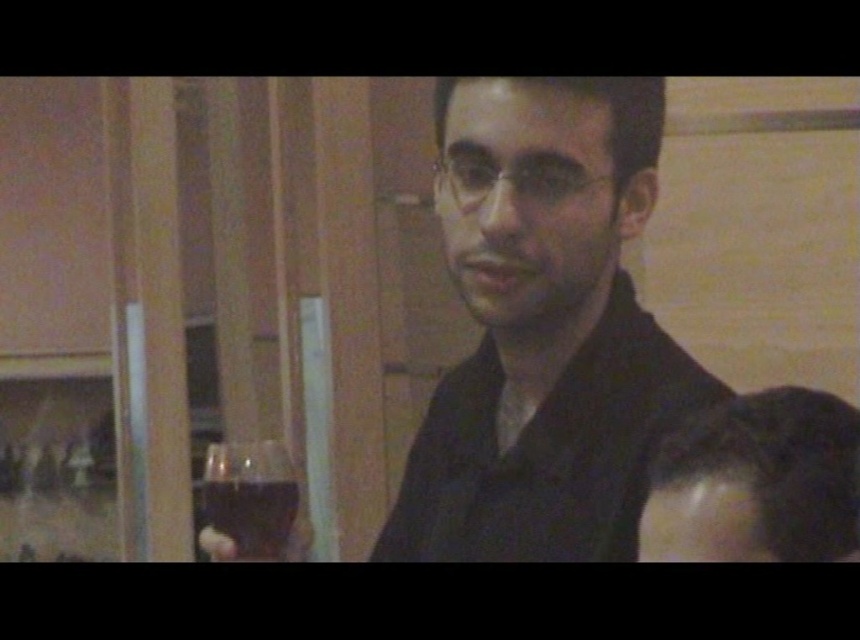
Can you confirm if matte black shirt at center is bigger than dark brown hair at lower right?

Yes.

The height and width of the screenshot is (640, 860). I want to click on matte black shirt at center, so click(544, 328).

Looking at this image, is dark brown hair at lower right in front of transparent glass at left?

Yes, it is in front of transparent glass at left.

Who is higher up, dark brown hair at lower right or transparent glass at left?

dark brown hair at lower right is above.

Which is behind, point (680, 486) or point (213, 509)?

Positioned behind is point (213, 509).

This screenshot has height=640, width=860. In order to click on dark brown hair at lower right in this screenshot , I will do click(x=757, y=483).

Is matte black shirt at center to the right of transparent glass at left from the viewer's perspective?

Yes, matte black shirt at center is to the right of transparent glass at left.

Is point (482, 106) less distant than point (269, 556)?

Yes, point (482, 106) is in front of point (269, 556).

Is point (482, 374) closer to viewer compared to point (266, 520)?

No, (482, 374) is further to viewer.

Identify the location of matte black shirt at center. The width and height of the screenshot is (860, 640). (544, 328).